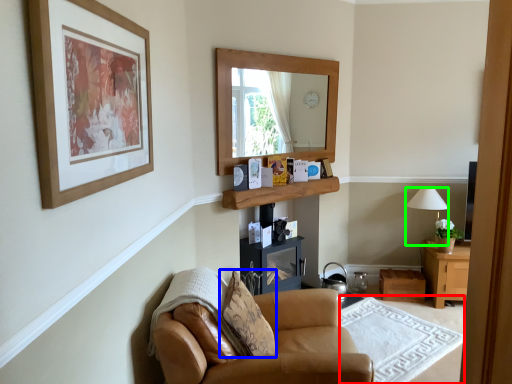
Question: Which object is the closest to the plain (highlighted by a red box)? Choose among these: pillow (highlighted by a blue box) or lamp (highlighted by a green box).

Choices:
 (A) pillow
 (B) lamp

Answer: (A)